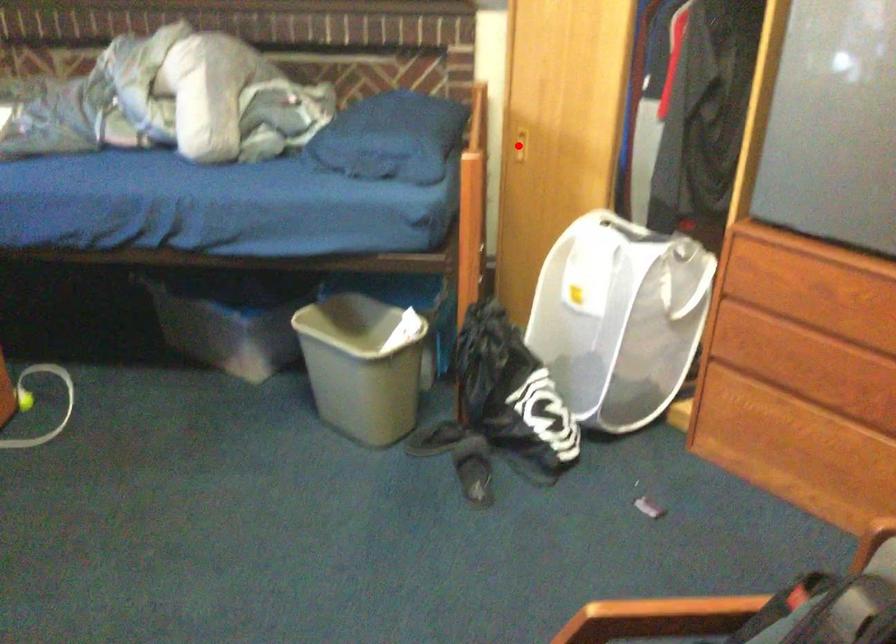
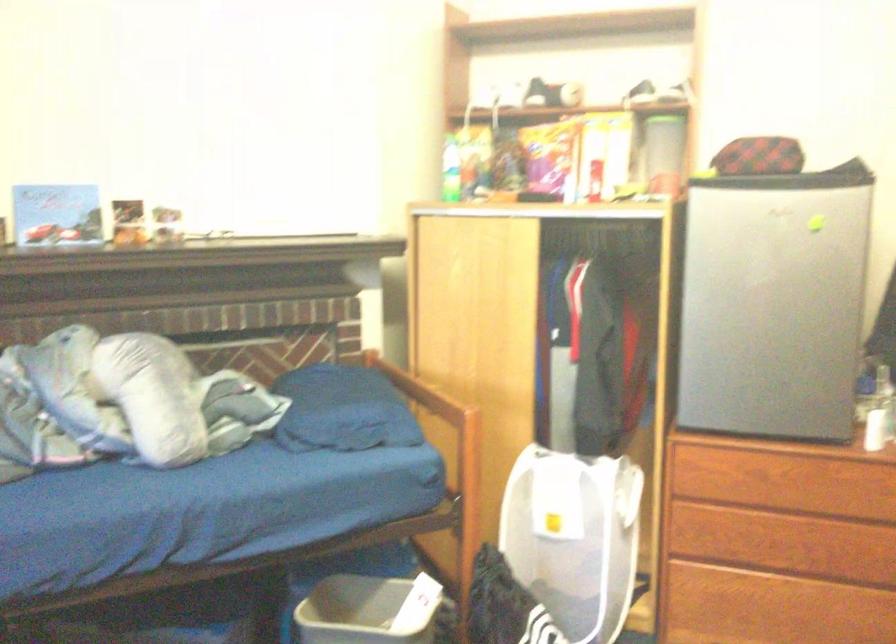
Question: I am providing you with two images of the same scene from different viewpoints. A red point is marked on the first image. Is the red point's position out of view in image 2?

Choices:
 (A) Yes
 (B) No

Answer: (A)